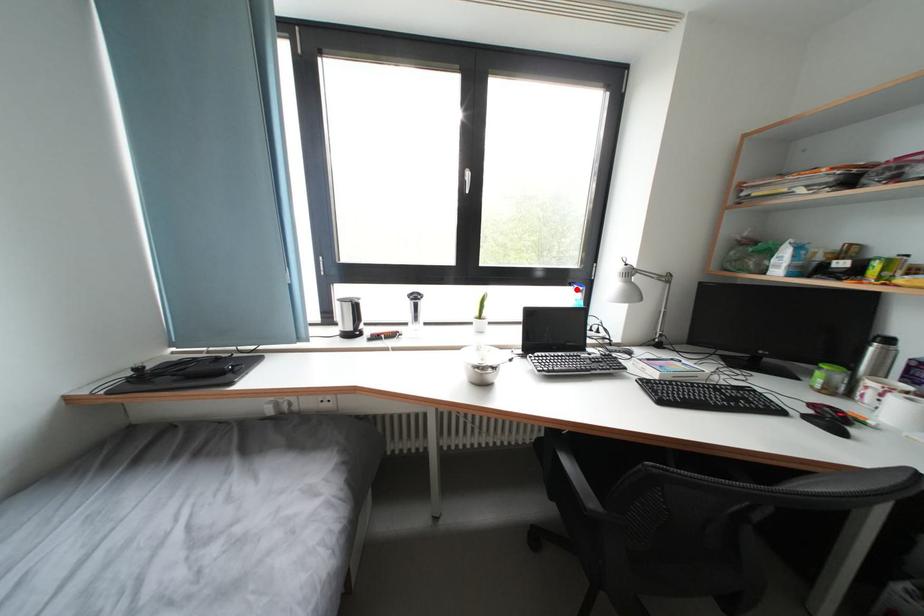
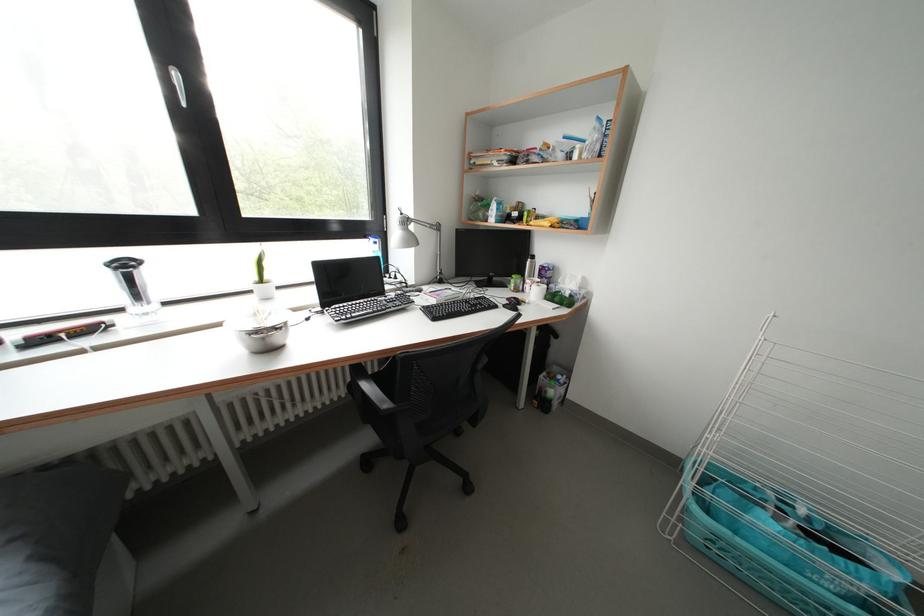
In the second image, find the point that corresponds to the highlighted location in the first image.

(371, 241)